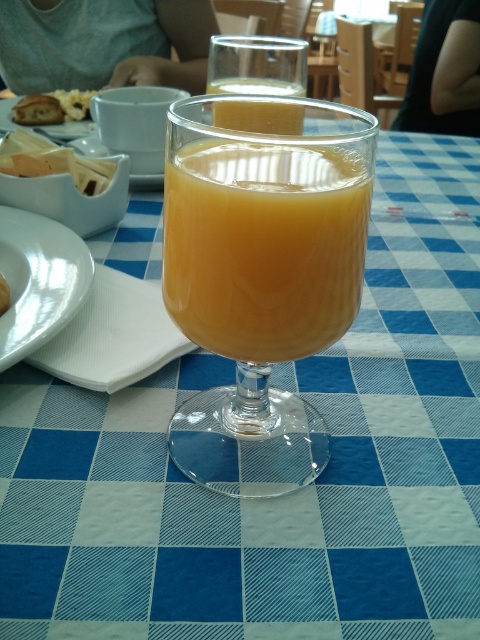
Question: Which is farther from the matte white cheese at upper left?

Choices:
 (A) translucent glass at center
 (B) white ceramic plate at lower left
 (C) translucent orange juice at center
 (D) matte brown bread at upper left

Answer: (D)

Question: Does matte white cheese at upper left have a larger size compared to matte white napkin at lower left?

Choices:
 (A) yes
 (B) no

Answer: (A)

Question: Is white ceramic plate at lower left above translucent glass at center?

Choices:
 (A) no
 (B) yes

Answer: (A)

Question: Which point is closer to the camera?

Choices:
 (A) matte brown bread at upper left
 (B) translucent orange juice at center
 (C) white ceramic plate at lower left
 (D) matte white napkin at lower left

Answer: (B)

Question: Can you confirm if matte white cheese at upper left is positioned above matte brown bread at upper left?

Choices:
 (A) yes
 (B) no

Answer: (B)

Question: Estimate the real-world distances between objects in this image. Which object is closer to the translucent glass at center?

Choices:
 (A) translucent orange juice at center
 (B) matte brown bread at upper left
 (C) matte white cheese at upper left

Answer: (A)